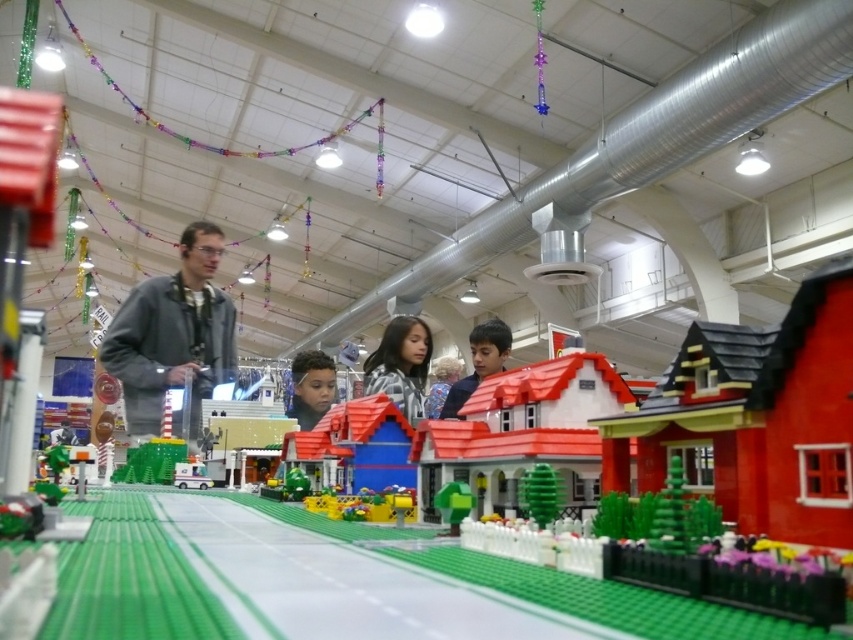
You are a photographer at the LEGO exhibition and want to take a photo of the plaid shirt at center and the smooth brown hair at center. Which object should you adjust the camera focus to first if you want to capture both clearly?

The plaid shirt at center is shorter than smooth brown hair at center, so you should focus on the plaid shirt at center first since it is closer to the camera.

You are a photographer at the LEGO exhibition and want to capture the gray matte jacket at upper left in your shot. The venue has a grid system where coordinates are measured from the bottom left corner. Where should you position your camera to include the jacket in the frame?

The gray matte jacket at upper left is located at coordinates point (173, 333). To include it in the frame, position your camera so that the jacket is within the camera view at those coordinates.